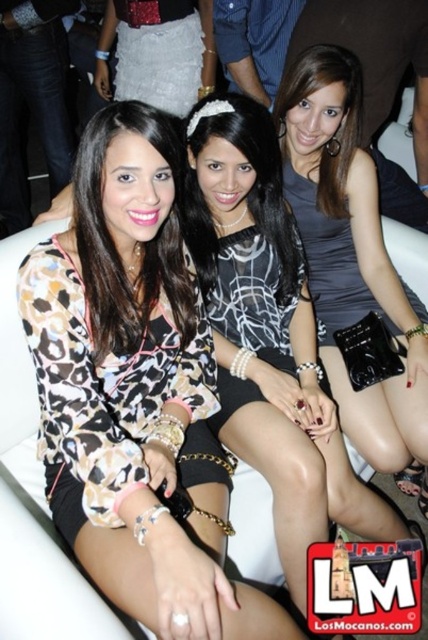
Who is positioned more to the right, leopard print fabric dress at center or silver metallic skirt at upper left?

From the viewer's perspective, leopard print fabric dress at center appears more on the right side.

Is leopard print fabric dress at center thinner than silver metallic skirt at upper left?

Indeed, leopard print fabric dress at center has a lesser width compared to silver metallic skirt at upper left.

Is point (70, 529) farther from viewer compared to point (133, 58)?

That is False.

The image size is (428, 640). What are the coordinates of `leopard print fabric dress at center` in the screenshot? It's located at (112, 388).

Who is positioned more to the left, leopard print blouse at center or black and white printed blouse at center?

From the viewer's perspective, leopard print blouse at center appears more on the left side.

Can you confirm if leopard print blouse at center is positioned below black and white printed blouse at center?

Yes.

The height and width of the screenshot is (640, 428). Identify the location of leopard print blouse at center. (134, 388).

Does point (341, 464) come farther from viewer compared to point (139, 32)?

No, (341, 464) is in front of (139, 32).

Between point (241, 445) and point (136, 42), which one is positioned in front?

Positioned in front is point (241, 445).

The image size is (428, 640). I want to click on black and white printed blouse at center, so click(269, 336).

You are a GUI agent. You are given a task and a screenshot of the screen. Output one action in this format:
    pyautogui.click(x=<x>, y=<y>)
    Task: Click on the black and white printed blouse at center
    
    Given the screenshot: What is the action you would take?
    pyautogui.click(x=269, y=336)